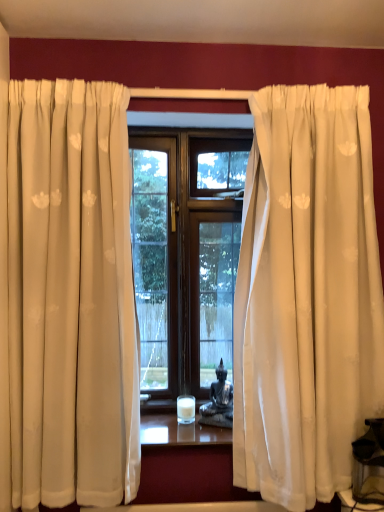
In order to click on vacant area in front of white wax candle at center in this screenshot , I will do point(185,432).